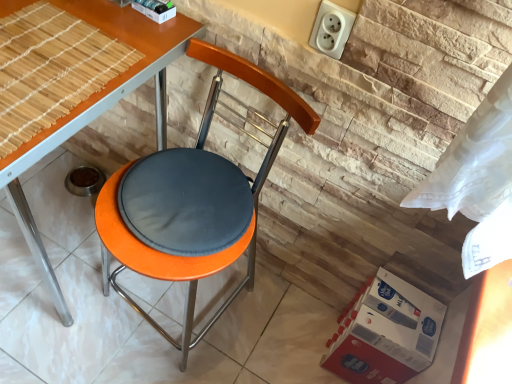
Question: Is the position of white plastic socket at upper right more distant than that of orange matte stool at center?

Choices:
 (A) no
 (B) yes

Answer: (A)

Question: Can you confirm if white plastic socket at upper right is taller than orange matte stool at center?

Choices:
 (A) yes
 (B) no

Answer: (A)

Question: Is white plastic socket at upper right closer to camera compared to orange matte stool at center?

Choices:
 (A) yes
 (B) no

Answer: (A)

Question: From the image's perspective, is white plastic socket at upper right under orange matte stool at center?

Choices:
 (A) no
 (B) yes

Answer: (A)

Question: From the image's perspective, is white plastic socket at upper right on orange matte stool at center?

Choices:
 (A) yes
 (B) no

Answer: (A)

Question: Is orange matte stool at center at the back of white plastic socket at upper right?

Choices:
 (A) yes
 (B) no

Answer: (B)

Question: Considering the relative sizes of orange fabric-covered chair at center and red cardboard box at lower right in the image provided, is orange fabric-covered chair at center smaller than red cardboard box at lower right?

Choices:
 (A) no
 (B) yes

Answer: (A)

Question: From a real-world perspective, is orange fabric-covered chair at center physically above red cardboard box at lower right?

Choices:
 (A) yes
 (B) no

Answer: (A)

Question: Is red cardboard box at lower right a part of orange fabric-covered chair at center?

Choices:
 (A) yes
 (B) no

Answer: (B)

Question: Is orange fabric-covered chair at center to the left of red cardboard box at lower right from the viewer's perspective?

Choices:
 (A) no
 (B) yes

Answer: (B)

Question: Is orange fabric-covered chair at center completely or partially outside of red cardboard box at lower right?

Choices:
 (A) no
 (B) yes

Answer: (B)

Question: From the image's perspective, is orange fabric-covered chair at center below red cardboard box at lower right?

Choices:
 (A) no
 (B) yes

Answer: (A)

Question: From a real-world perspective, is orange matte stool at center positioned over white plastic socket at upper right based on gravity?

Choices:
 (A) no
 (B) yes

Answer: (A)